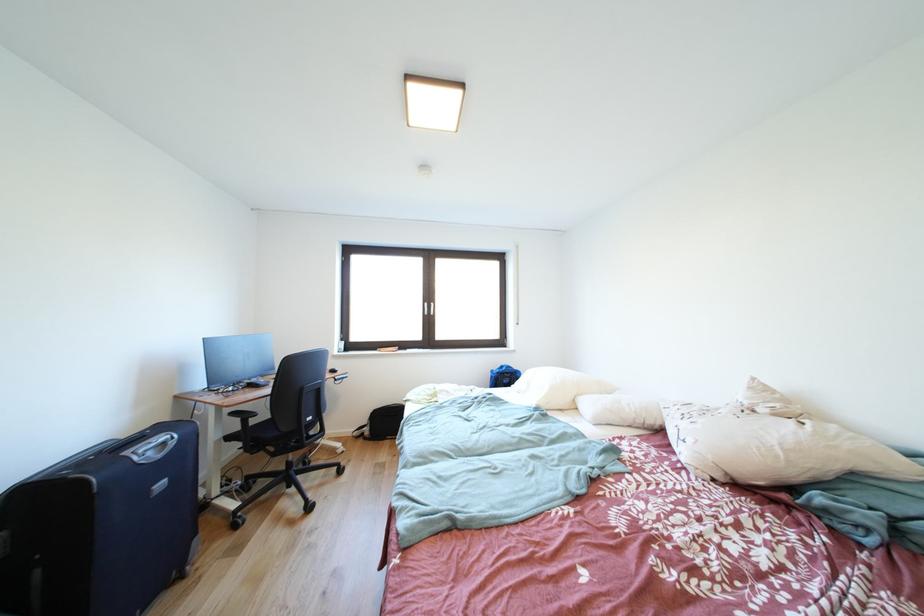
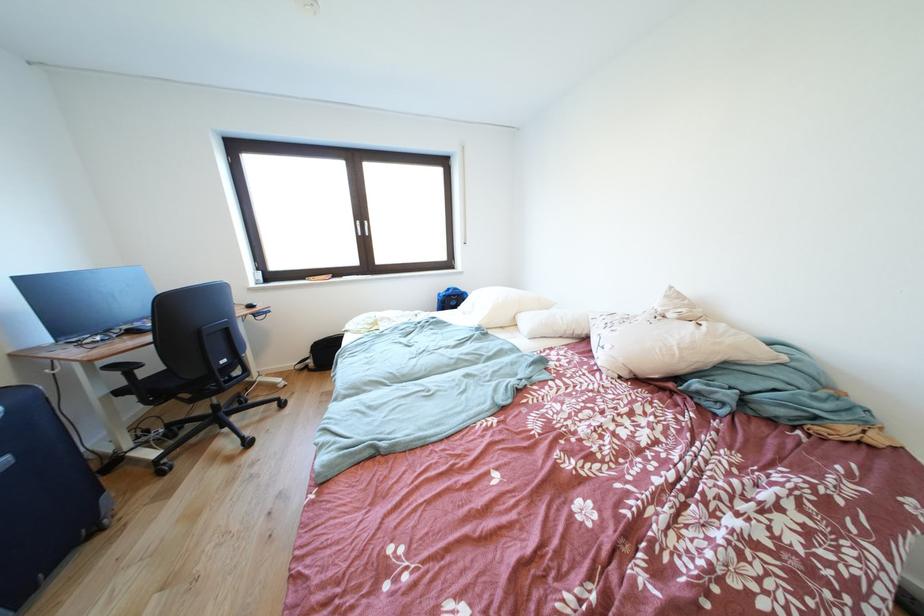
The point at (x=244, y=418) is marked in the first image. Where is the corresponding point in the second image?

(120, 371)